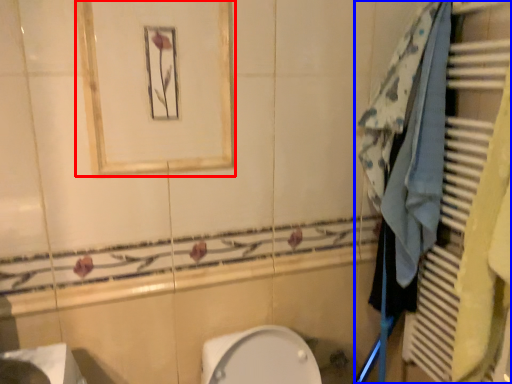
Question: Which of the following is the closest to the observer, medicine cabinet (highlighted by a red box) or closet (highlighted by a blue box)?

Choices:
 (A) medicine cabinet
 (B) closet

Answer: (B)